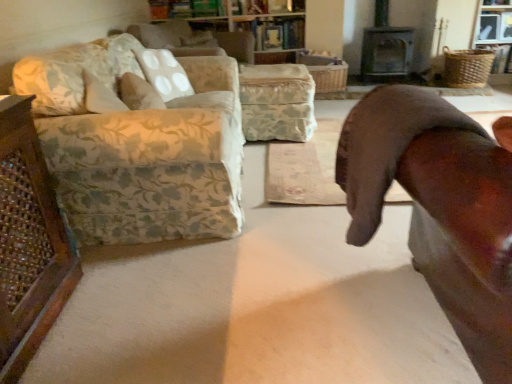
Question: Considering the positions of floral fabric pillow at upper left, the first pillow when ordered from bottom to top, and floral fabric couch at left in the image, is floral fabric pillow at upper left, the first pillow when ordered from bottom to top, taller or shorter than floral fabric couch at left?

Choices:
 (A) short
 (B) tall

Answer: (A)

Question: Considering the positions of floral fabric pillow at upper left, the first pillow when ordered from front to back, and floral fabric couch at left in the image, is floral fabric pillow at upper left, the first pillow when ordered from front to back, bigger or smaller than floral fabric couch at left?

Choices:
 (A) small
 (B) big

Answer: (A)

Question: Which is nearer to the floral fabric couch at left?

Choices:
 (A) brown leather chair at right
 (B) metallic gray fireplace at upper right
 (C) floral fabric pillow at upper left, the second pillow in the back-to-front sequence
 (D) white dotted fabric pillow at upper center, the first pillow viewed from the top
 (E) wooden bookshelf at upper center

Answer: (C)

Question: Estimate the real-world distances between objects in this image. Which object is farther from the brown leather chair at right?

Choices:
 (A) white dotted fabric pillow at upper center, marked as the 2th pillow in a bottom-to-top arrangement
 (B) floral fabric pillow at upper left, the first pillow when ordered from front to back
 (C) wooden bookshelf at upper center
 (D) metallic gray fireplace at upper right
 (E) floral fabric couch at left

Answer: (D)